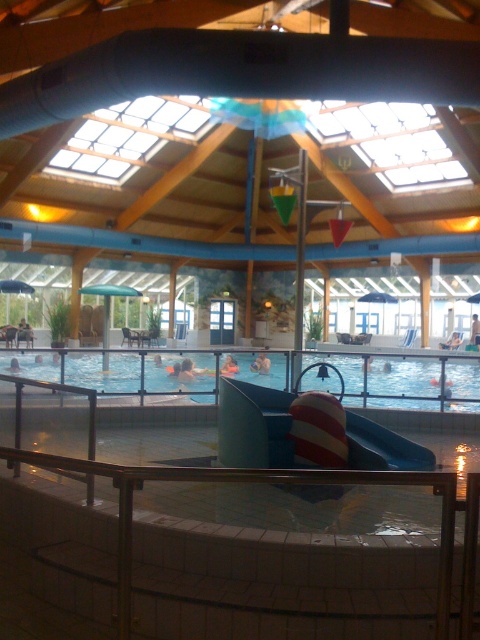
Question: Does clear plastic pool at center have a smaller size compared to smooth skin person at lower left?

Choices:
 (A) no
 (B) yes

Answer: (A)

Question: Is light blue fabric swimmer at center below skinny white person at center?

Choices:
 (A) no
 (B) yes

Answer: (B)

Question: Does light blue fabric swimmer at center appear on the left side of skinny white person at center?

Choices:
 (A) no
 (B) yes

Answer: (B)

Question: Which point is closer to the camera?

Choices:
 (A) orange rubber ring at center
 (B) clear plastic pool at center
 (C) smooth skin person at lower left

Answer: (B)

Question: Which point is closer to the camera?

Choices:
 (A) light blue fabric swimmer at center
 (B) orange rubber ring at center

Answer: (B)

Question: Which object is closer to the camera taking this photo?

Choices:
 (A) light blue fabric swimmer at center
 (B) clear plastic pool at center
 (C) orange rubber ring at center

Answer: (B)